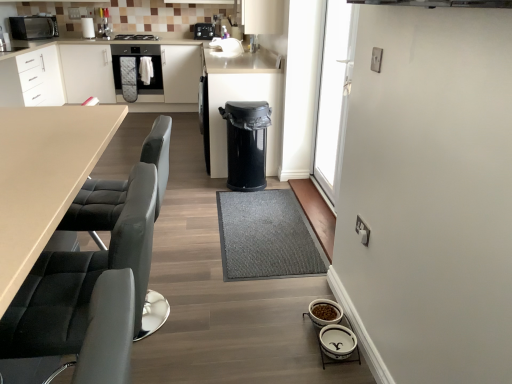
Image resolution: width=512 pixels, height=384 pixels. Identify the location of free point to the right of black plastic trash can at center. pos(285,185).